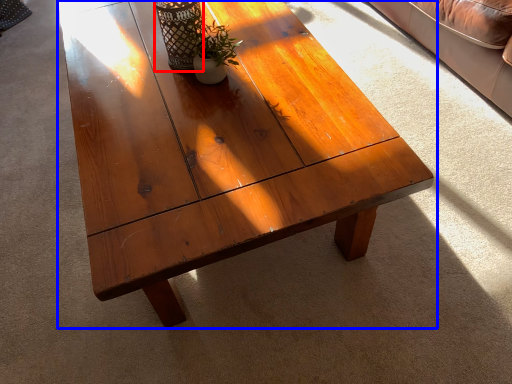
Question: Which object appears farthest to the camera in this image, glass vase (highlighted by a red box) or coffee table (highlighted by a blue box)?

Choices:
 (A) glass vase
 (B) coffee table

Answer: (A)